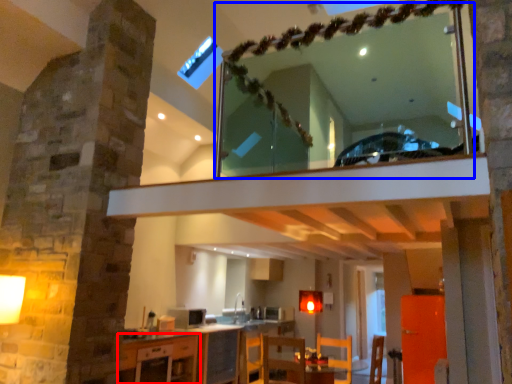
Question: Which object is closer to the camera taking this photo, cabinetry (highlighted by a red box) or mirror (highlighted by a blue box)?

Choices:
 (A) cabinetry
 (B) mirror

Answer: (B)